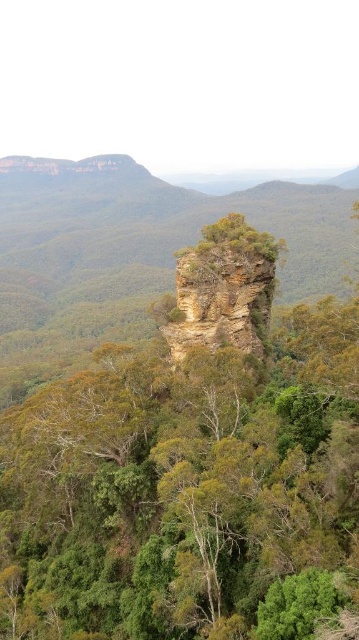
You are a hiker standing at the base of the rock formations. You notice both the green rough rock formation at center and the brown rough rock at center. Which rock is located higher up on the same central area?

The brown rough rock at center is positioned higher up than the green rough rock formation at center, so the brown rough rock at center is located higher up.

You are standing in front of the rock formation and notice two points marked on the rock surface. The first point is at coordinates point (x=193, y=378) and the second is at point (x=176, y=308). Which point should you approach first if you want to reach the one closer to you?

You should approach point (x=193, y=378) first because it is closer to you than point (x=176, y=308).

You are a hiker who wants to take a photo of both the green rough rock formation at center and the brown rough rock at center. You have a camera with a maximum zoom range that can capture objects up to 10 meters apart. Can you capture both rocks in a single photo without moving your camera position?

The distance between the green rough rock formation at center and the brown rough rock at center is 12.03 meters, which exceeds the camera maximum zoom range of 10 meters. Therefore, you cannot capture both rocks in a single photo without moving your camera position.